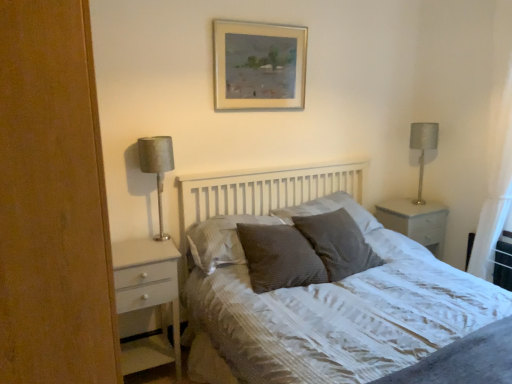
Where is `blank space situated above satin silver lamp at left (from a real-world perspective)`? blank space situated above satin silver lamp at left (from a real-world perspective) is located at coordinates (153, 140).